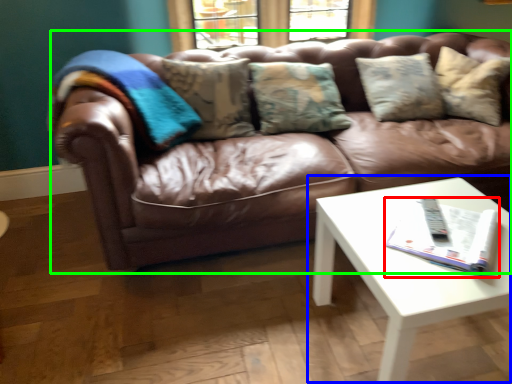
Question: Based on their relative distances, which object is nearer to magazine (highlighted by a red box)? Choose from coffee table (highlighted by a blue box) and studio couch (highlighted by a green box).

Choices:
 (A) coffee table
 (B) studio couch

Answer: (A)